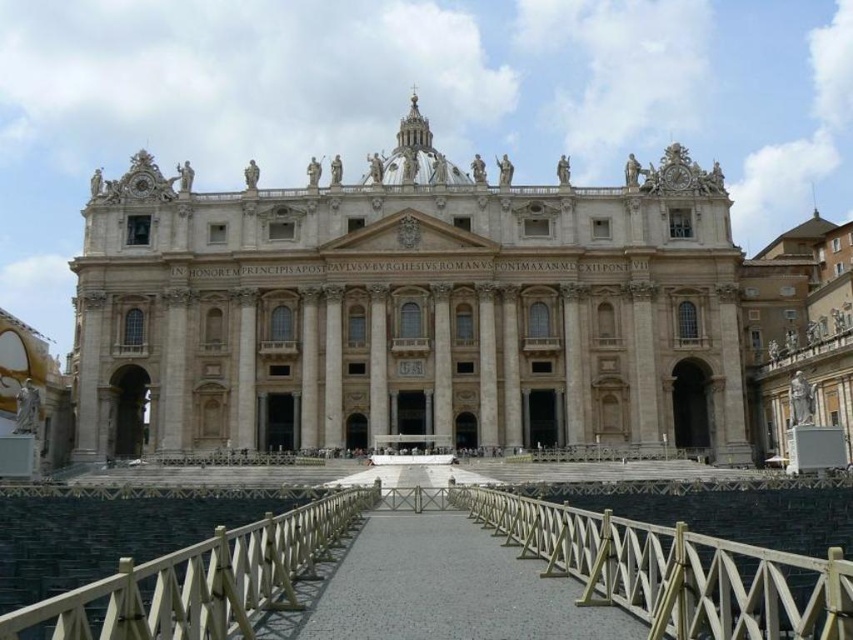
You are a tourist standing at the gold metallic rail at center, wanting to take a photo of the beige stone church at center. If your camera has a maximum focus range of 30 meters, will you be able to capture the church clearly?

The distance between the beige stone church at center and the gold metallic rail at center is 33.35 meters, which exceeds the camera maximum focus range of 30 meters. Therefore, the camera cannot capture the church clearly.

You are standing at the entrance of the beige stone church at center. If you walk straight ahead, will you be facing the dome or the entrance archways?

The beige stone church at center is located at point coordinates that are nearly the center of the image, so walking straight ahead from the entrance would lead you toward the dome, which is centrally positioned.